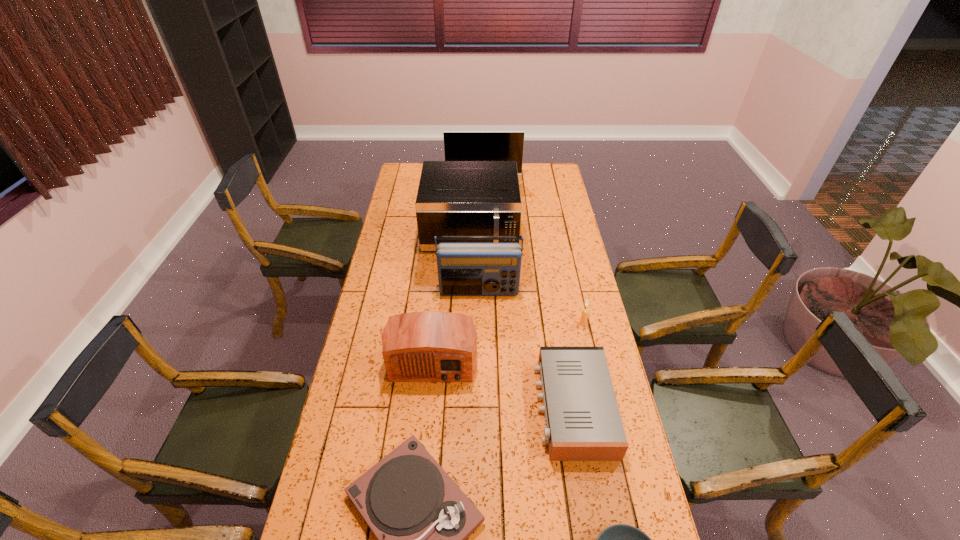
Where is `the closest radio receiver to the phonograph_record`? The image size is (960, 540). the closest radio receiver to the phonograph_record is located at coordinates (583, 423).

Identify the location of vacant space that satisfies the following two spatial constraints: 1. on the front panel of the fifth nearest object; 2. on the right side of the tallest radio receiver. This screenshot has width=960, height=540. (479, 323).